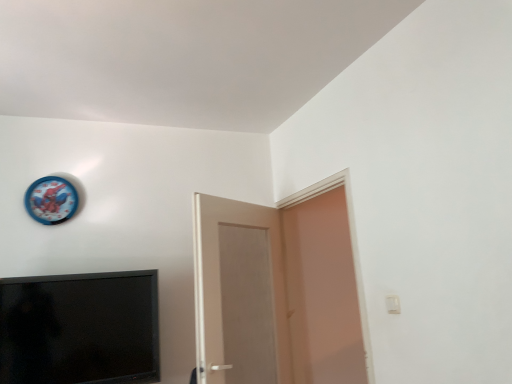
In order to face blue plastic clock at upper left, should I rotate leftwards or rightwards?

Turn left by 25.146 degrees to look at blue plastic clock at upper left.

Describe the element at coordinates (51, 200) in the screenshot. This screenshot has height=384, width=512. I see `blue plastic clock at upper left` at that location.

Identify the location of matte white door at right, arranged as the first door when viewed from the right. This screenshot has height=384, width=512. (322, 292).

You are a GUI agent. You are given a task and a screenshot of the screen. Output one action in this format:
    pyautogui.click(x=<x>, y=<y>)
    Task: Click on the white matte door at center, which is the first door from left to right
    This screenshot has width=512, height=384.
    Given the screenshot: What is the action you would take?
    pyautogui.click(x=239, y=293)

What do you see at coordinates (79, 328) in the screenshot? The image size is (512, 384). I see `black matte television at lower left` at bounding box center [79, 328].

What are the coordinates of `blue plastic clock at upper left` in the screenshot? It's located at (51, 200).

From the image's perspective, who appears lower, white matte door at center, the 2th door viewed from the right, or matte white door at right, which ranks as the 2th door in left-to-right order?

white matte door at center, the 2th door viewed from the right, is shown below in the image.

Which is behind, white matte door at center, which is the first door from left to right, or matte white door at right, arranged as the first door when viewed from the right?

white matte door at center, which is the first door from left to right, is further from the camera.

Find the location of a particular element. Image resolution: width=512 pixels, height=384 pixels. door in front of the white matte door at center, which is the first door from left to right is located at coordinates (322, 292).

From a real-world perspective, is white matte door at center, which is the first door from left to right, under matte white door at right, arranged as the first door when viewed from the right?

Correct, in the physical world, white matte door at center, which is the first door from left to right, is lower than matte white door at right, arranged as the first door when viewed from the right.

Is blue plastic clock at upper left far from matte white door at right, which ranks as the 2th door in left-to-right order?

Yes.

Who is bigger, blue plastic clock at upper left or matte white door at right, which ranks as the 2th door in left-to-right order?

With larger size is matte white door at right, which ranks as the 2th door in left-to-right order.

Which object is wider, blue plastic clock at upper left or matte white door at right, arranged as the first door when viewed from the right?

With larger width is matte white door at right, arranged as the first door when viewed from the right.

Is matte white door at right, which ranks as the 2th door in left-to-right order, aimed at blue plastic clock at upper left?

Yes, matte white door at right, which ranks as the 2th door in left-to-right order, is aimed at blue plastic clock at upper left.

From the image's perspective, which object appears higher, matte white door at right, arranged as the first door when viewed from the right, or blue plastic clock at upper left?

blue plastic clock at upper left.

Looking at this image, does matte white door at right, arranged as the first door when viewed from the right, contain blue plastic clock at upper left?

That's incorrect, blue plastic clock at upper left is not inside matte white door at right, arranged as the first door when viewed from the right.

Who is smaller, matte white door at right, arranged as the first door when viewed from the right, or blue plastic clock at upper left?

Smaller between the two is blue plastic clock at upper left.

Is matte white door at right, which ranks as the 2th door in left-to-right order, with black matte television at lower left?

No.

Locate an element on the screen. television on the left of matte white door at right, which ranks as the 2th door in left-to-right order is located at coordinates (79, 328).

Can you confirm if matte white door at right, arranged as the first door when viewed from the right, is taller than black matte television at lower left?

Correct, matte white door at right, arranged as the first door when viewed from the right, is much taller as black matte television at lower left.

I want to click on the 2nd door positioned above the black matte television at lower left (from a real-world perspective), so click(x=322, y=292).

Would you say black matte television at lower left contains matte white door at right, arranged as the first door when viewed from the right?

No, matte white door at right, arranged as the first door when viewed from the right, is not inside black matte television at lower left.

Is the surface of black matte television at lower left in direct contact with matte white door at right, arranged as the first door when viewed from the right?

black matte television at lower left is not next to matte white door at right, arranged as the first door when viewed from the right, and they're not touching.

Consider the image. Which of these two, black matte television at lower left or matte white door at right, which ranks as the 2th door in left-to-right order, is thinner?

matte white door at right, which ranks as the 2th door in left-to-right order, is thinner.

Considering the relative sizes of black matte television at lower left and white matte door at center, which is the first door from left to right, in the image provided, is black matte television at lower left bigger than white matte door at center, which is the first door from left to right,?

No, black matte television at lower left is not bigger than white matte door at center, which is the first door from left to right.

Which object is thinner, black matte television at lower left or white matte door at center, which is the first door from left to right?

With smaller width is black matte television at lower left.

Based on their positions, is black matte television at lower left located to the left or right of white matte door at center, which is the first door from left to right?

Clearly, black matte television at lower left is on the left of white matte door at center, which is the first door from left to right, in the image.

Would you consider black matte television at lower left to be distant from white matte door at center, the 2th door viewed from the right?

No.

Based on the photo, between black matte television at lower left and blue plastic clock at upper left, which one has smaller size?

blue plastic clock at upper left.

Could you tell me if black matte television at lower left is facing blue plastic clock at upper left?

No, black matte television at lower left is not aimed at blue plastic clock at upper left.

From a real-world perspective, is black matte television at lower left physically located above or below blue plastic clock at upper left?

black matte television at lower left is below blue plastic clock at upper left.

Is black matte television at lower left positioned behind blue plastic clock at upper left?

No, it is not.

Where is `door behind the matte white door at right, which ranks as the 2th door in left-to-right order`? The image size is (512, 384). door behind the matte white door at right, which ranks as the 2th door in left-to-right order is located at coordinates point(239,293).

You are a GUI agent. You are given a task and a screenshot of the screen. Output one action in this format:
    pyautogui.click(x=<x>, y=<y>)
    Task: Click on the 1st door below when counting from the blue plastic clock at upper left (from the image's perspective)
    The width and height of the screenshot is (512, 384).
    Given the screenshot: What is the action you would take?
    pyautogui.click(x=322, y=292)

Looking at the image, which one is located further to black matte television at lower left, blue plastic clock at upper left or matte white door at right, which ranks as the 2th door in left-to-right order?

Based on the image, matte white door at right, which ranks as the 2th door in left-to-right order, appears to be further to black matte television at lower left.

Consider the image. Based on their spatial positions, is black matte television at lower left or white matte door at center, which is the first door from left to right, closer to matte white door at right, which ranks as the 2th door in left-to-right order?

white matte door at center, which is the first door from left to right, is positioned closer to the anchor matte white door at right, which ranks as the 2th door in left-to-right order.

From the image, which object appears to be farther from matte white door at right, arranged as the first door when viewed from the right, white matte door at center, the 2th door viewed from the right, or black matte television at lower left?

Based on the image, black matte television at lower left appears to be further to matte white door at right, arranged as the first door when viewed from the right.

Based on their spatial positions, is white matte door at center, which is the first door from left to right, or blue plastic clock at upper left further from black matte television at lower left?

Among the two, blue plastic clock at upper left is located further to black matte television at lower left.

Based on their spatial positions, is matte white door at right, arranged as the first door when viewed from the right, or white matte door at center, the 2th door viewed from the right, closer to blue plastic clock at upper left?

white matte door at center, the 2th door viewed from the right, lies closer to blue plastic clock at upper left than the other object.

When comparing their distances from matte white door at right, arranged as the first door when viewed from the right, does black matte television at lower left or blue plastic clock at upper left seem further?

Based on the image, blue plastic clock at upper left appears to be further to matte white door at right, arranged as the first door when viewed from the right.

When comparing their distances from black matte television at lower left, does blue plastic clock at upper left or white matte door at center, which is the first door from left to right, seem closer?

white matte door at center, which is the first door from left to right, is positioned closer to the anchor black matte television at lower left.

Which object lies nearer to the anchor point matte white door at right, which ranks as the 2th door in left-to-right order, blue plastic clock at upper left or white matte door at center, the 2th door viewed from the right?

Based on the image, white matte door at center, the 2th door viewed from the right, appears to be nearer to matte white door at right, which ranks as the 2th door in left-to-right order.

At what (x,y) coordinates should I click in order to perform the action: click on television between blue plastic clock at upper left and matte white door at right, which ranks as the 2th door in left-to-right order, in the horizontal direction. Please return your answer as a coordinate pair (x, y). Looking at the image, I should click on (79, 328).

Image resolution: width=512 pixels, height=384 pixels. In order to click on door between black matte television at lower left and matte white door at right, which ranks as the 2th door in left-to-right order in this screenshot , I will do `click(239, 293)`.

This screenshot has width=512, height=384. I want to click on door between blue plastic clock at upper left and matte white door at right, arranged as the first door when viewed from the right, so pos(239,293).

Where is `television situated between blue plastic clock at upper left and white matte door at center, the 2th door viewed from the right, from left to right`? television situated between blue plastic clock at upper left and white matte door at center, the 2th door viewed from the right, from left to right is located at coordinates (79, 328).